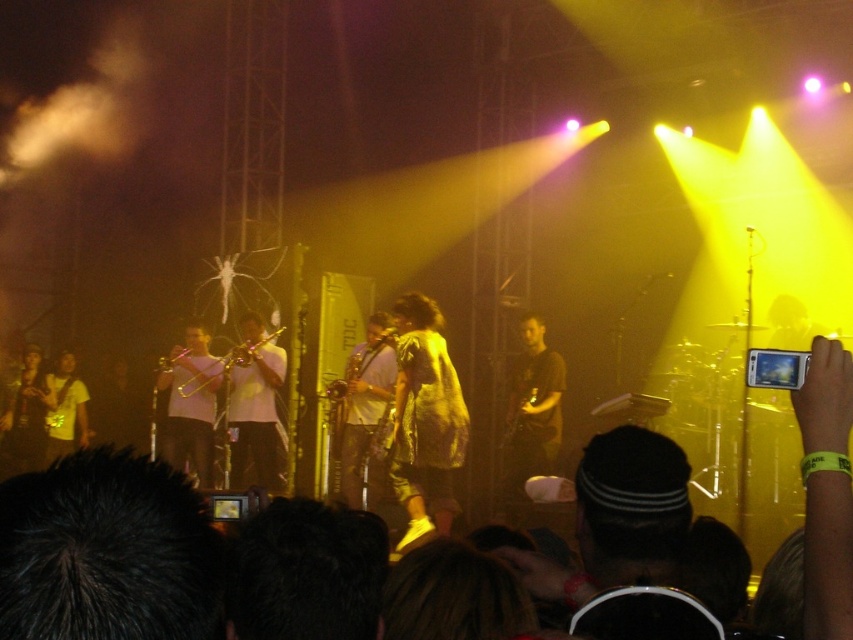
Question: Which point is farther from the camera taking this photo?

Choices:
 (A) (171, 452)
 (B) (277, 381)
 (C) (416, 445)
 (D) (527, 403)

Answer: (A)

Question: Is shiny metallic shirt at center closer to camera compared to white matte trumpet at center?

Choices:
 (A) yes
 (B) no

Answer: (A)

Question: Which of the following is the farthest from the observer?

Choices:
 (A) gold brass trombone at center
 (B) white matte trumpet at center
 (C) metallic gold guitar at center

Answer: (A)

Question: Does shiny metallic shirt at center appear on the right side of yellow shirt at left?

Choices:
 (A) no
 (B) yes

Answer: (B)

Question: Which of the following is the closest to the observer?

Choices:
 (A) (514, 410)
 (B) (207, 352)
 (C) (425, 310)

Answer: (C)

Question: Is shiny metallic shirt at center above metallic gold guitar at center?

Choices:
 (A) yes
 (B) no

Answer: (A)